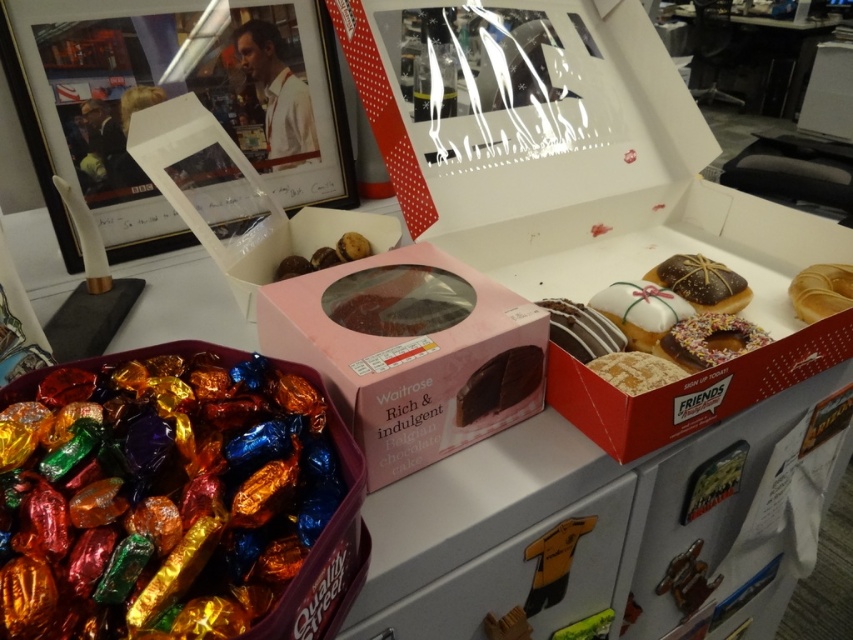
Question: Is chocolate-coated donut at center thinner than glazed donut at right?

Choices:
 (A) no
 (B) yes

Answer: (A)

Question: Which point appears closest to the camera in this image?

Choices:
 (A) (582, 356)
 (B) (807, 278)
 (C) (469, 627)

Answer: (C)

Question: Which of the following is the farthest from the observer?

Choices:
 (A) (x=457, y=634)
 (B) (x=668, y=300)

Answer: (B)

Question: Considering the real-world distances, which object is closest to the white glaze donut at center?

Choices:
 (A) glazed donut at right
 (B) dark chocolate cake at center
 (C) sprinkled chocolate donut at center
 (D) metallic foil wrapped chocolates at lower left

Answer: (C)

Question: Can you confirm if shiny chocolate donut at center is positioned below glazed donut at right?

Choices:
 (A) yes
 (B) no

Answer: (A)

Question: Is sprinkled chocolate donut at center below shiny chocolate donut at center?

Choices:
 (A) yes
 (B) no

Answer: (A)